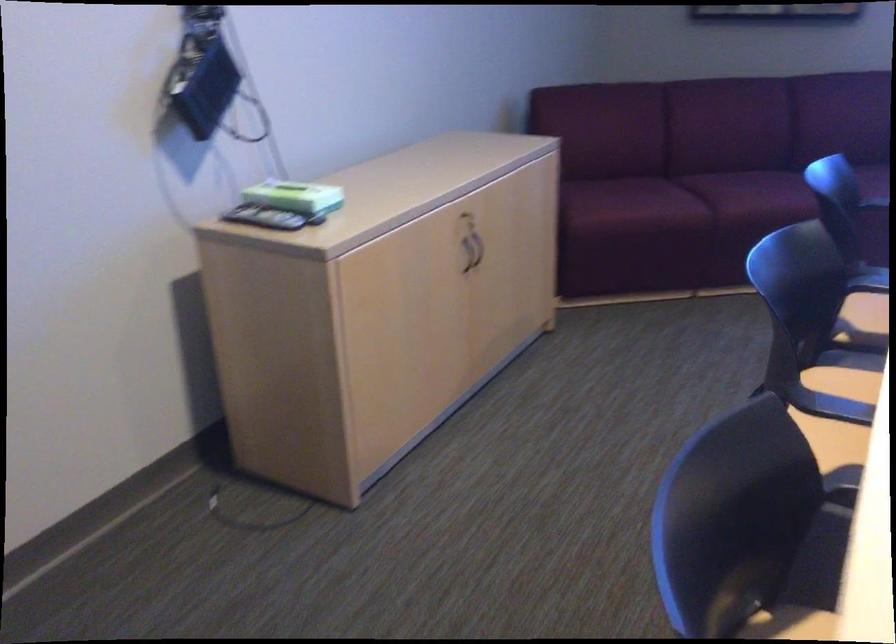
I want to click on chair sitting surface, so click(x=857, y=384).